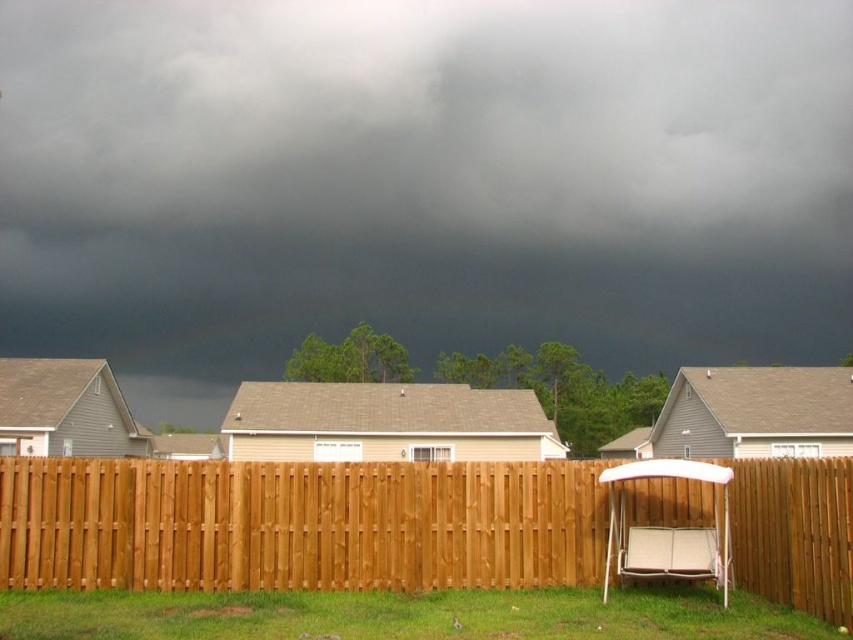
Is dark gray cloud at upper center positioned in front of brown wooden fence at center?

No.

Who is higher up, dark gray cloud at upper center or brown wooden fence at center?

dark gray cloud at upper center is higher up.

Who is more forward, (566, 10) or (508, 480)?

Point (508, 480) is more forward.

Find the location of a particular element. This screenshot has width=853, height=640. dark gray cloud at upper center is located at coordinates (421, 180).

Does dark gray cloud at upper center lie in front of green grass at lower center?

No, dark gray cloud at upper center is further to the viewer.

Can you confirm if dark gray cloud at upper center is shorter than green grass at lower center?

No.

Does point (561, 216) lie behind point (367, 605)?

Yes, it is.

The height and width of the screenshot is (640, 853). What are the coordinates of `dark gray cloud at upper center` in the screenshot? It's located at (421, 180).

Between brown wooden fence at center and green grass at lower center, which one has less height?

Answer: With less height is green grass at lower center.

Who is more forward, (146,500) or (482,593)?

Point (482,593) is in front.

Is point (456, 563) positioned behind point (685, 596)?

Yes, it is behind point (685, 596).

This screenshot has width=853, height=640. What are the coordinates of `brown wooden fence at center` in the screenshot? It's located at (299, 524).